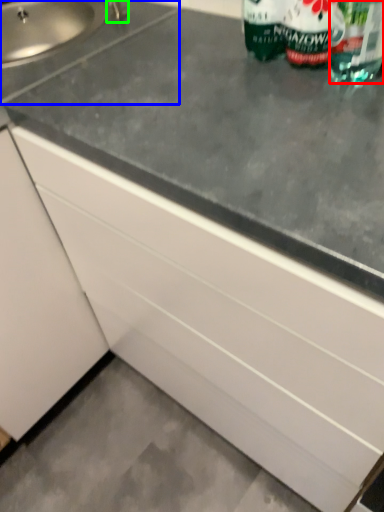
Question: Which object is the closest to the drinking straw (highlighted by a red box)? Choose among these: sink (highlighted by a blue box) or faucet (highlighted by a green box).

Choices:
 (A) sink
 (B) faucet

Answer: (A)